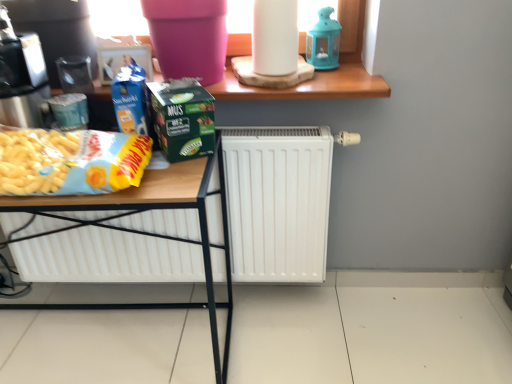
Question: Is the depth of white matte paper towel at upper center less than that of white matte radiator at center?

Choices:
 (A) yes
 (B) no

Answer: (A)

Question: From a real-world perspective, is white matte paper towel at upper center on white matte radiator at center?

Choices:
 (A) yes
 (B) no

Answer: (A)

Question: Is white matte paper towel at upper center far away from white matte radiator at center?

Choices:
 (A) no
 (B) yes

Answer: (A)

Question: Could you tell me if white matte paper towel at upper center is turned towards white matte radiator at center?

Choices:
 (A) no
 (B) yes

Answer: (A)

Question: Is the depth of white matte paper towel at upper center greater than that of white matte radiator at center?

Choices:
 (A) no
 (B) yes

Answer: (A)

Question: From the image's perspective, is green matte carton at center positioned above or below metallic silver coffee machine at left?

Choices:
 (A) below
 (B) above

Answer: (A)

Question: In terms of height, does green matte carton at center look taller or shorter compared to metallic silver coffee machine at left?

Choices:
 (A) short
 (B) tall

Answer: (A)

Question: Considering their positions, is green matte carton at center located in front of or behind metallic silver coffee machine at left?

Choices:
 (A) behind
 (B) front

Answer: (A)

Question: Considering the positions of green matte carton at center and metallic silver coffee machine at left in the image, is green matte carton at center wider or thinner than metallic silver coffee machine at left?

Choices:
 (A) wide
 (B) thin

Answer: (B)

Question: In the image, is metallic silver coffee machine at left positioned in front of or behind blue glass lantern at upper center?

Choices:
 (A) behind
 (B) front

Answer: (B)

Question: Considering the positions of point (2, 100) and point (331, 44), is point (2, 100) closer or farther from the camera than point (331, 44)?

Choices:
 (A) farther
 (B) closer

Answer: (B)

Question: Would you say metallic silver coffee machine at left is inside or outside blue glass lantern at upper center?

Choices:
 (A) outside
 (B) inside

Answer: (A)

Question: From a real-world perspective, is metallic silver coffee machine at left physically located above or below blue glass lantern at upper center?

Choices:
 (A) below
 (B) above

Answer: (A)

Question: Is point (20, 248) closer or farther from the camera than point (105, 210)?

Choices:
 (A) closer
 (B) farther

Answer: (B)

Question: Which is correct: white matte radiator at center is inside matte plastic table at center, or outside of it?

Choices:
 (A) inside
 (B) outside

Answer: (B)